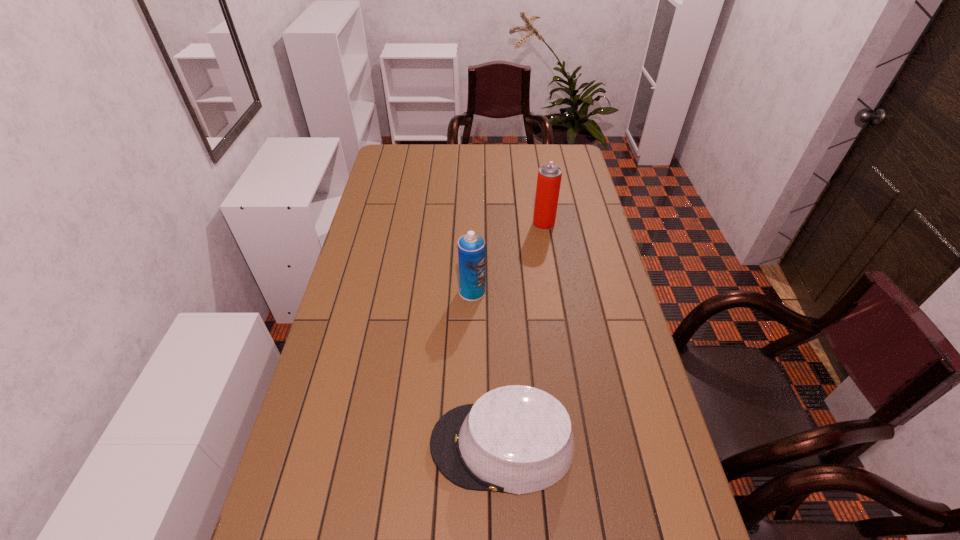
The image size is (960, 540). In order to click on free point located 0.090m on the front-facing side of the hat in this screenshot , I will do `click(394, 445)`.

What are the coordinates of `free space at the far edge` in the screenshot? It's located at (488, 147).

Image resolution: width=960 pixels, height=540 pixels. In order to click on free space at the left edge in this screenshot , I will do `click(414, 177)`.

Identify the location of free space at the right edge. Image resolution: width=960 pixels, height=540 pixels. (564, 190).

Identify the location of free spot between the shortest object and the second farthest object. (488, 368).

At what (x,y) coordinates should I click in order to perform the action: click on free space between the second nearest object and the right aerosol can. Please return your answer as a coordinate pair (x, y). Looking at the image, I should click on (508, 258).

What are the coordinates of `free space between the hat and the farthest object` in the screenshot? It's located at (523, 334).

Where is `free space that is in between the second nearest object and the hat`? The width and height of the screenshot is (960, 540). free space that is in between the second nearest object and the hat is located at coordinates (488, 368).

You are a GUI agent. You are given a task and a screenshot of the screen. Output one action in this format:
    pyautogui.click(x=<x>, y=<y>)
    Task: Click on the vacant region between the hat and the farthest object
    The height and width of the screenshot is (540, 960).
    Given the screenshot: What is the action you would take?
    pyautogui.click(x=523, y=334)

Locate which object is the second closest to the nearest object. Please provide its 2D coordinates. Your answer should be formatted as a tuple, i.e. [(x, y)], where the tuple contains the x and y coordinates of a point satisfying the conditions above.

[(549, 177)]